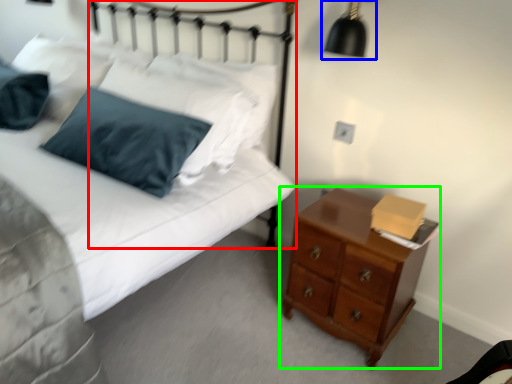
Question: Which is nearer to the headboard (highlighted by a red box)? lamp (highlighted by a blue box) or chest of drawers (highlighted by a green box).

Choices:
 (A) lamp
 (B) chest of drawers

Answer: (A)